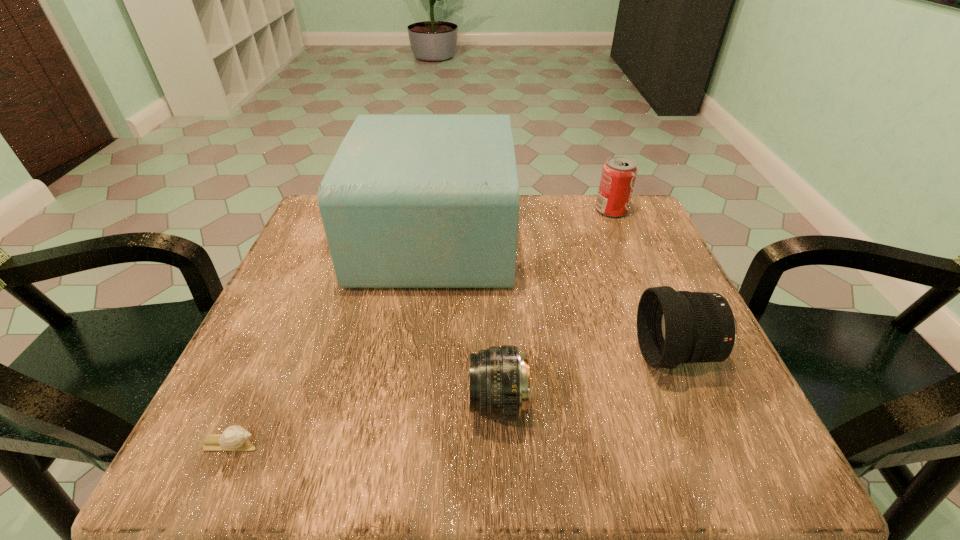
In order to click on radio receiver present at the left edge in this screenshot , I will do `click(409, 201)`.

Locate an element on the screen. escargot positioned at the left edge is located at coordinates (234, 438).

Find the location of a particular element. This screenshot has height=540, width=960. soda can present at the right edge is located at coordinates (619, 173).

Find the location of `telephoto lens located in the right edge section of the desktop`. telephoto lens located in the right edge section of the desktop is located at coordinates (673, 327).

You are a GUI agent. You are given a task and a screenshot of the screen. Output one action in this format:
    pyautogui.click(x=<x>, y=<y>)
    Task: Click on the object located in the far left corner section of the desktop
    
    Given the screenshot: What is the action you would take?
    pyautogui.click(x=409, y=201)

I want to click on object that is positioned at the near left corner, so click(x=234, y=438).

Identify the location of object positioned at the far right corner. (619, 173).

Locate an element on the screen. vacant space at the far edge of the desktop is located at coordinates (564, 194).

Where is `blank space at the near edge`? blank space at the near edge is located at coordinates (543, 462).

In the image, there is a desktop. Identify the location of vacant space at the left edge. This screenshot has height=540, width=960. (259, 335).